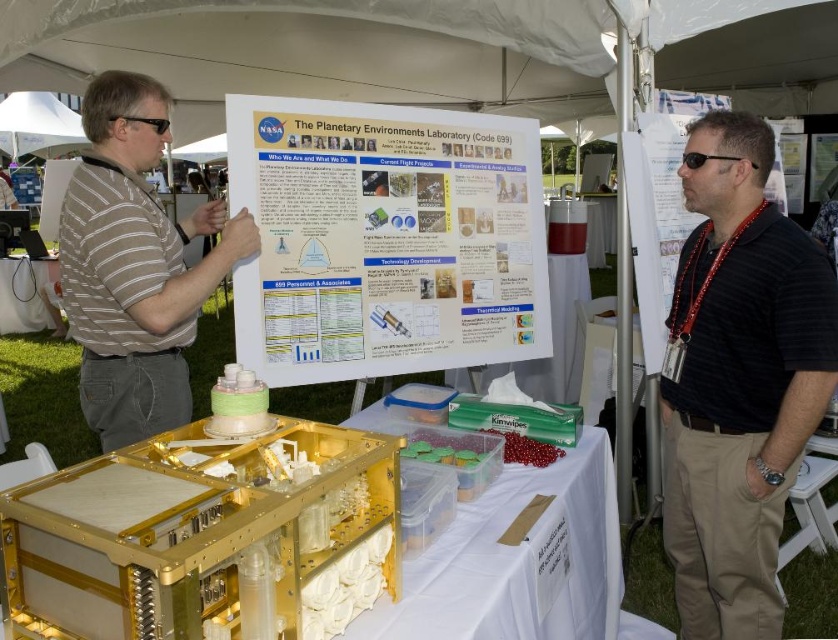
Does white paper at center appear under black striped shirt at center?

Incorrect, white paper at center is not positioned below black striped shirt at center.

Identify the location of white paper at center. (385, 240).

Between point (344, 317) and point (88, 256), which one is positioned behind?

The point (344, 317) is more distant.

You are a GUI agent. You are given a task and a screenshot of the screen. Output one action in this format:
    pyautogui.click(x=<x>, y=<y>)
    Task: Click on the white paper at center
    This screenshot has width=838, height=640.
    Given the screenshot: What is the action you would take?
    pyautogui.click(x=385, y=240)

Who is more distant from viewer, (831, 364) or (559, 448)?

Point (559, 448)

In order to click on black striped shirt at center in this screenshot , I will do `click(738, 380)`.

The image size is (838, 640). Find the location of `black striped shirt at center`. black striped shirt at center is located at coordinates (738, 380).

Locate an element on the screen. This screenshot has height=640, width=838. black striped shirt at center is located at coordinates (738, 380).